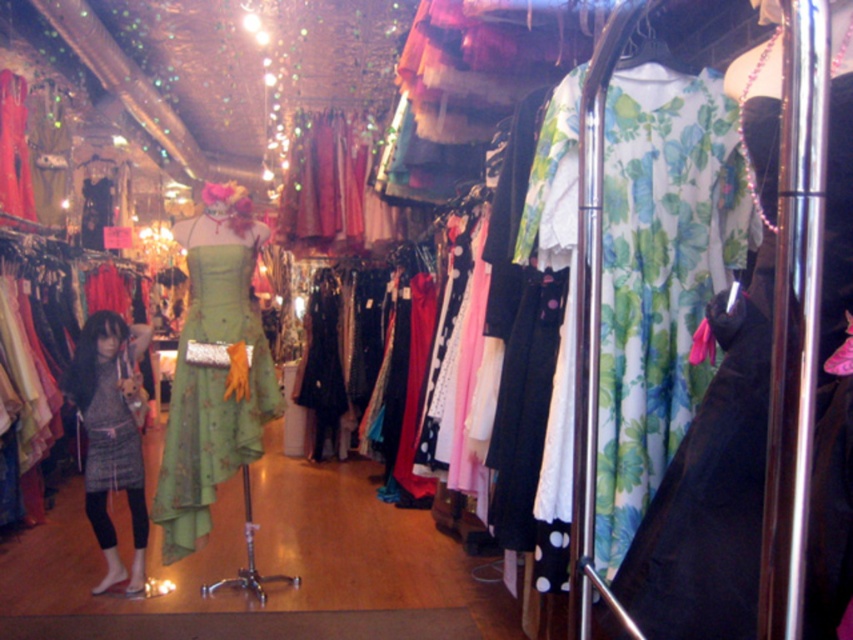
Question: Which point is farther to the camera?

Choices:
 (A) (206, 244)
 (B) (132, 352)

Answer: (B)

Question: Can you confirm if green floral fabric dress at center is positioned below gray textured dress at center?

Choices:
 (A) no
 (B) yes

Answer: (A)

Question: Can you confirm if green floral fabric dress at right is smaller than gray textured dress at center?

Choices:
 (A) yes
 (B) no

Answer: (A)

Question: Is green floral fabric dress at center to the left of gray textured dress at center from the viewer's perspective?

Choices:
 (A) yes
 (B) no

Answer: (B)

Question: Which object is farther from the camera taking this photo?

Choices:
 (A) gray textured dress at center
 (B) green floral fabric dress at center
 (C) green floral fabric dress at right

Answer: (A)

Question: Which object appears closest to the camera in this image?

Choices:
 (A) green floral fabric dress at center
 (B) green floral fabric dress at right
 (C) gray textured dress at center

Answer: (B)